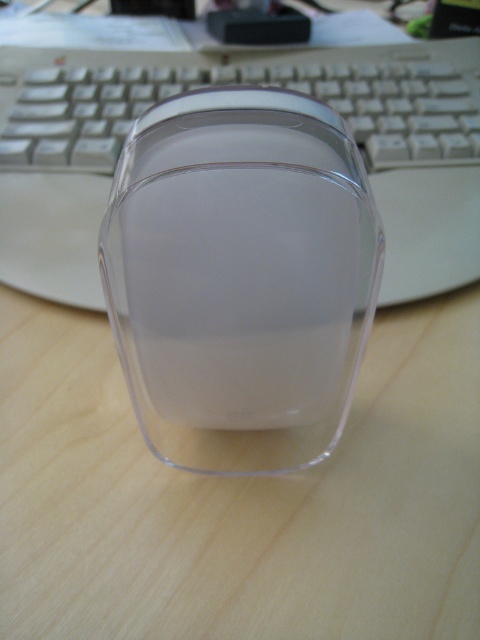
Can you confirm if transparent plastic mouse at center is positioned below white plastic keyboard at center?

Indeed, transparent plastic mouse at center is positioned under white plastic keyboard at center.

Does transparent plastic mouse at center have a smaller size compared to white plastic keyboard at center?

Yes.

At what (x,y) coordinates should I click in order to perform the action: click on transparent plastic mouse at center. Please return your answer as a coordinate pair (x, y). The width and height of the screenshot is (480, 640). Looking at the image, I should click on (240, 276).

Where is `transparent plastic mouse at center`? The image size is (480, 640). transparent plastic mouse at center is located at coordinates (240, 276).